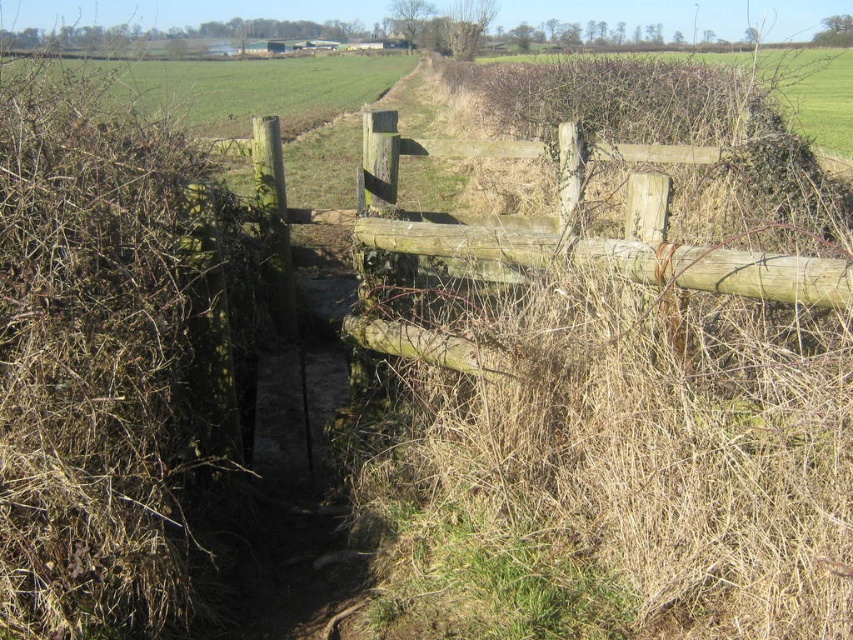
From the picture: You are standing at the stile and want to find the green grass at upper left. According to the coordinates provided, where exactly should you look to find it?

The green grass at upper left is located at the coordinates point (x=248, y=88).

You are a hiker with a map that shows the distance between landmarks. You see a brown dry hedge at left and a brown dry grass at upper center. According to your map, which one is farther from your current position?

The brown dry hedge at left is 81.36 feet away from brown dry grass at upper center. Since the distance between them is fixed, you cannot determine which is farther from your current position without knowing your exact location relative to both.